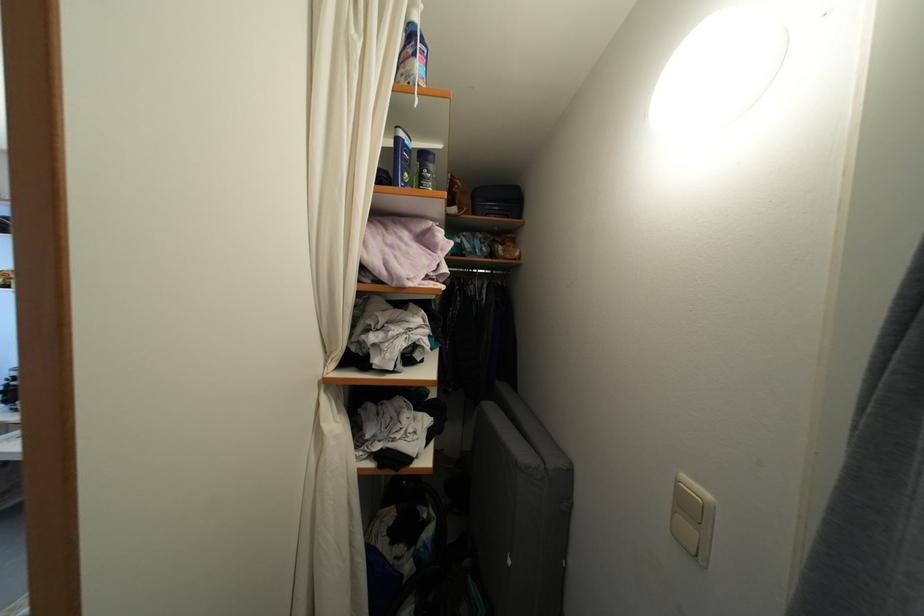
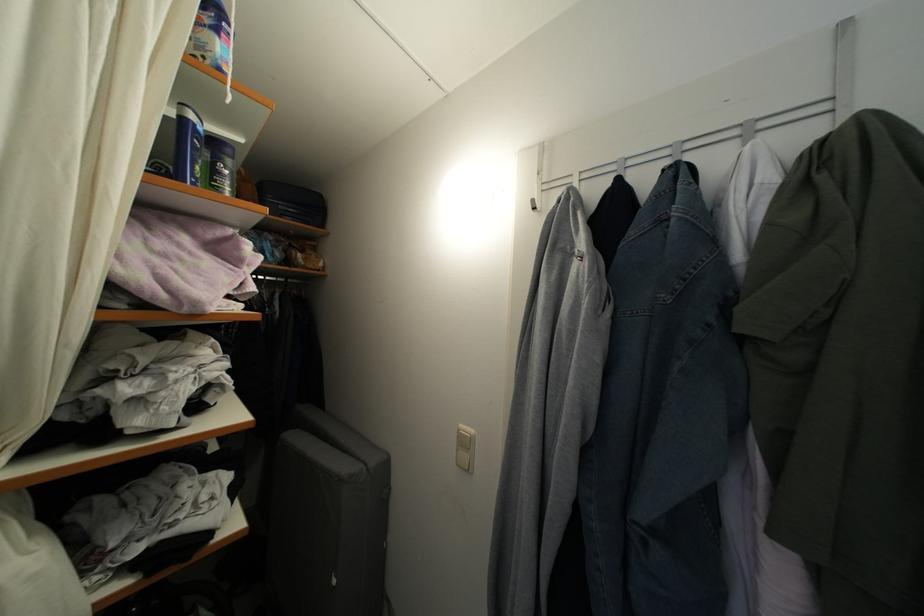
The point at (436, 172) is marked in the first image. Where is the corresponding point in the second image?

(235, 168)